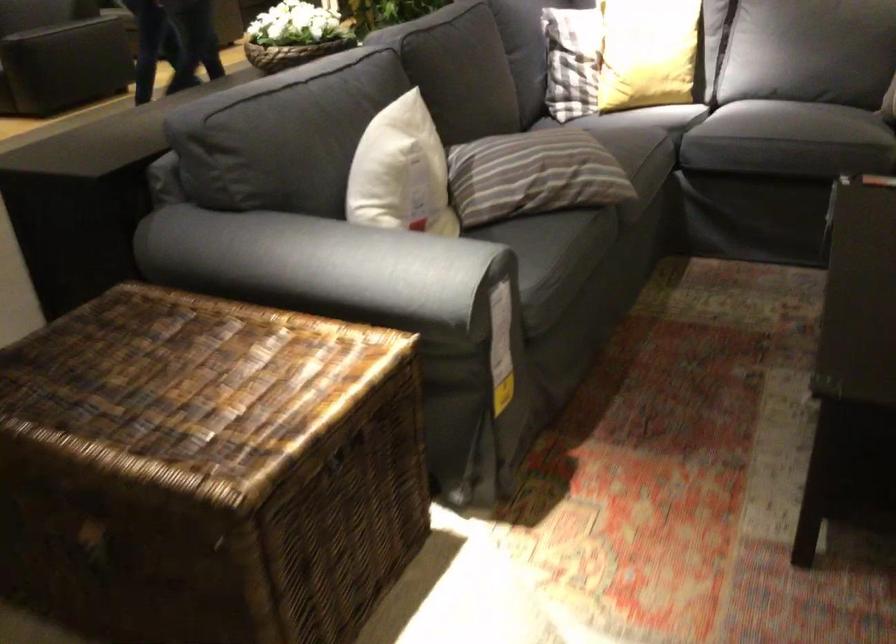
The width and height of the screenshot is (896, 644). Describe the element at coordinates (768, 122) in the screenshot. I see `the grey sofa sitting surface` at that location.